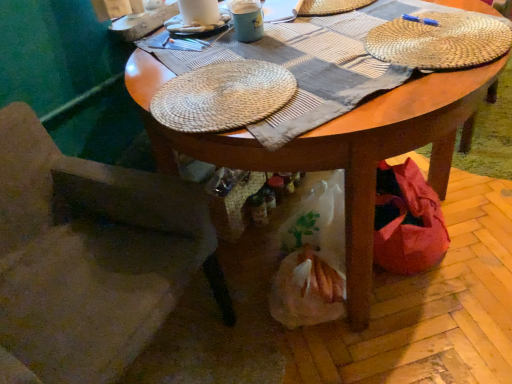
Where is `free spot to the left of matte ceramic mug at upper center`? free spot to the left of matte ceramic mug at upper center is located at coordinates (194, 39).